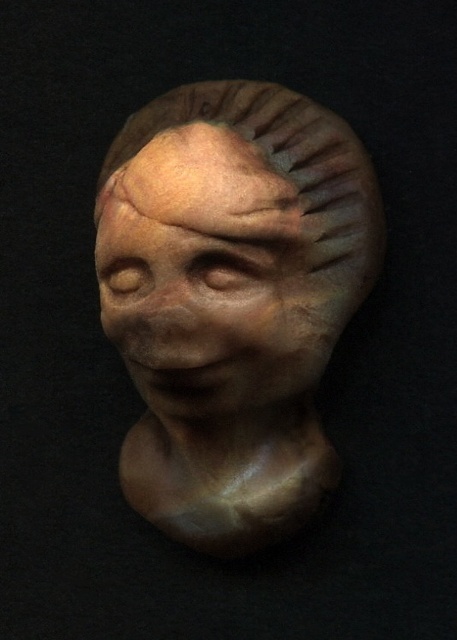
Does point (359, 227) lie in front of point (234, 221)?

No.

Can you confirm if matte clay head at center is positioned to the right of matte clay face at center?

Indeed, matte clay head at center is positioned on the right side of matte clay face at center.

Where is `matte clay head at center`? Image resolution: width=457 pixels, height=640 pixels. matte clay head at center is located at coordinates (232, 301).